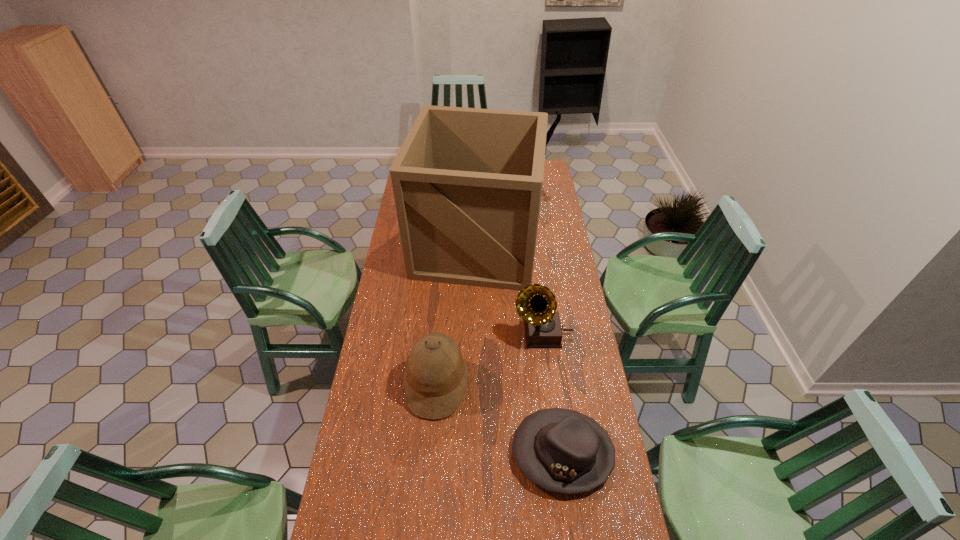
Where is `free space located on the face of the farthest object`? The width and height of the screenshot is (960, 540). free space located on the face of the farthest object is located at coordinates (459, 178).

The width and height of the screenshot is (960, 540). I want to click on vacant space situated 0.200m on the face of the farthest object, so click(452, 178).

Identify the location of free space located 0.190m from the horn of the third farthest object. (468, 333).

In order to click on vacant region located 0.210m from the horn of the third farthest object in this screenshot , I will do `click(464, 333)`.

Where is `vacant space situated from the horn of the third farthest object`? vacant space situated from the horn of the third farthest object is located at coordinates (461, 333).

Where is `vacant space situated 0.210m on the front-facing side of the taller hat`? vacant space situated 0.210m on the front-facing side of the taller hat is located at coordinates (522, 383).

Identify the location of free space located on the decorative side of the shorter hat. (403, 453).

Find the location of a particular element. vacant space located on the decorative side of the shorter hat is located at coordinates (418, 453).

Image resolution: width=960 pixels, height=540 pixels. I want to click on vacant position located 0.290m on the decorative side of the shorter hat, so click(426, 453).

Where is `object that is at the far edge`? The width and height of the screenshot is (960, 540). object that is at the far edge is located at coordinates (550, 132).